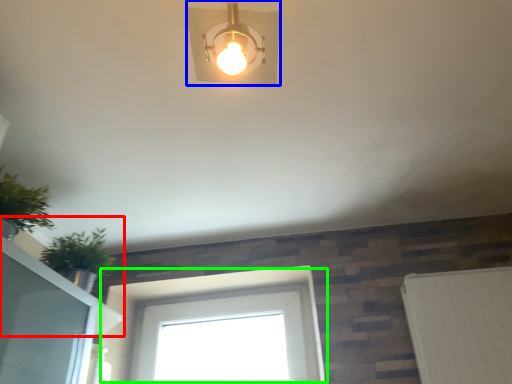
Question: Estimate the real-world distances between objects in this image. Which object is farther from window sill (highlighted by a red box), lamp (highlighted by a blue box) or window (highlighted by a green box)?

Choices:
 (A) lamp
 (B) window

Answer: (A)